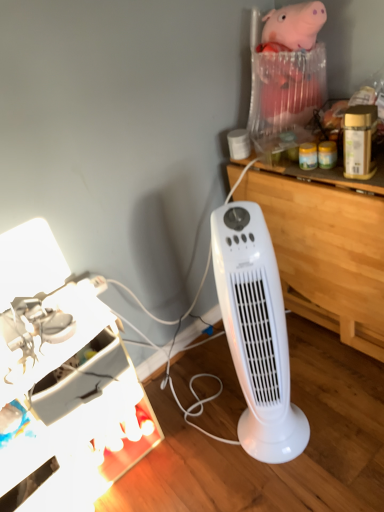
Question: Should I look upward or downward to see metallic silver desk lamp at lower left?

Choices:
 (A) up
 (B) down

Answer: (B)

Question: Is metallic silver desk lamp at lower left completely or partially outside of white plastic tower fan at center?

Choices:
 (A) yes
 (B) no

Answer: (A)

Question: From a real-world perspective, is metallic silver desk lamp at lower left under white plastic tower fan at center?

Choices:
 (A) no
 (B) yes

Answer: (B)

Question: Is metallic silver desk lamp at lower left bigger than white plastic tower fan at center?

Choices:
 (A) yes
 (B) no

Answer: (A)

Question: From a real-world perspective, is metallic silver desk lamp at lower left located higher than white plastic tower fan at center?

Choices:
 (A) yes
 (B) no

Answer: (B)

Question: Is metallic silver desk lamp at lower left shorter than white plastic tower fan at center?

Choices:
 (A) no
 (B) yes

Answer: (B)

Question: From the image's perspective, is metallic silver desk lamp at lower left on top of white plastic tower fan at center?

Choices:
 (A) no
 (B) yes

Answer: (A)

Question: Does white plastic tower fan at center turn towards metallic silver desk lamp at lower left?

Choices:
 (A) no
 (B) yes

Answer: (A)

Question: Is white plastic tower fan at center not near metallic silver desk lamp at lower left?

Choices:
 (A) yes
 (B) no

Answer: (B)

Question: Is white plastic tower fan at center shorter than metallic silver desk lamp at lower left?

Choices:
 (A) no
 (B) yes

Answer: (A)

Question: Is white plastic tower fan at center positioned with its back to metallic silver desk lamp at lower left?

Choices:
 (A) no
 (B) yes

Answer: (A)

Question: From the image's perspective, is white plastic tower fan at center above metallic silver desk lamp at lower left?

Choices:
 (A) no
 (B) yes

Answer: (B)

Question: Considering the relative sizes of white plastic tower fan at center and metallic silver desk lamp at lower left in the image provided, is white plastic tower fan at center thinner than metallic silver desk lamp at lower left?

Choices:
 (A) yes
 (B) no

Answer: (A)

Question: Is wooden at right touching metallic silver desk lamp at lower left?

Choices:
 (A) yes
 (B) no

Answer: (B)